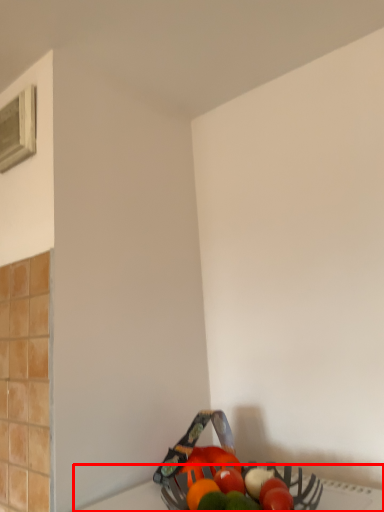
Question: From the image's perspective, what is the correct spatial relationship of table top (annotated by the red box) in relation to window?

Choices:
 (A) below
 (B) above

Answer: (A)